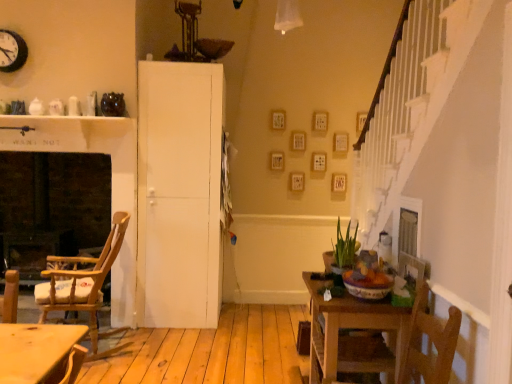
Locate an element on the screen. This screenshot has width=512, height=384. vacant space in front of white matte door at center is located at coordinates [x=177, y=338].